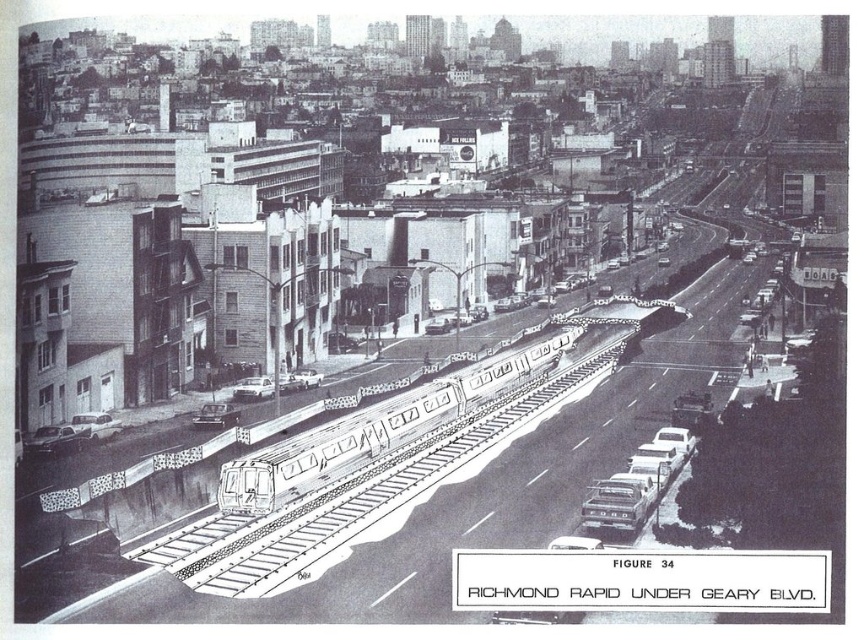
You are a city planner reviewing the proposed Richmond Rapid Under Geary Blvd transit system. You need to determine if a specific point marked at coordinates (369, 433) falls on the train structure. Based on the provided image, does this point lie on the train structure?

The point at (369, 433) is on the smooth silver train at center, so yes, the point lies on the train structure.

You are a city planner reviewing the proposed Richmond Rapid Under Geary Blvd transit system. You need to ensure that the elevated train tracks are at least 80 meters away from any residential buildings to comply with noise regulations. Based on the image provided, is the point at coordinates point (306,465) meeting this requirement?

The distance between point (306,465) and the viewer is 79.59 meters, which is less than the required 80 meters. Therefore, the point at coordinates point (306,465) does not meet the noise regulation requirement.